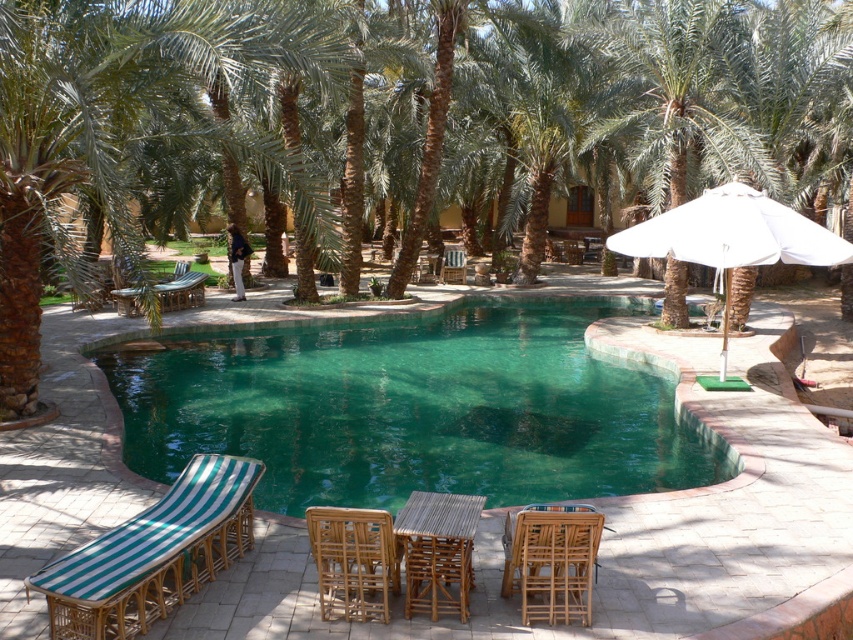
Question: Which object is closer to the camera taking this photo?

Choices:
 (A) green glass swimming pool at center
 (B) bamboo table at center

Answer: (B)

Question: From the image, what is the correct spatial relationship of bamboo chair at lower center in relation to rattan chair at center?

Choices:
 (A) above
 (B) below

Answer: (A)

Question: Which object is the farthest from the white fabric umbrella at right?

Choices:
 (A) bamboo table at center
 (B) green glass swimming pool at center

Answer: (A)

Question: Where is white fabric umbrella at right located in relation to bamboo chair at lower center in the image?

Choices:
 (A) above
 (B) below

Answer: (A)

Question: Does bamboo table at center have a greater width compared to rattan chair at center?

Choices:
 (A) no
 (B) yes

Answer: (B)

Question: Which point appears farthest from the camera in this image?

Choices:
 (A) (450, 568)
 (B) (209, 576)
 (C) (459, 250)

Answer: (C)